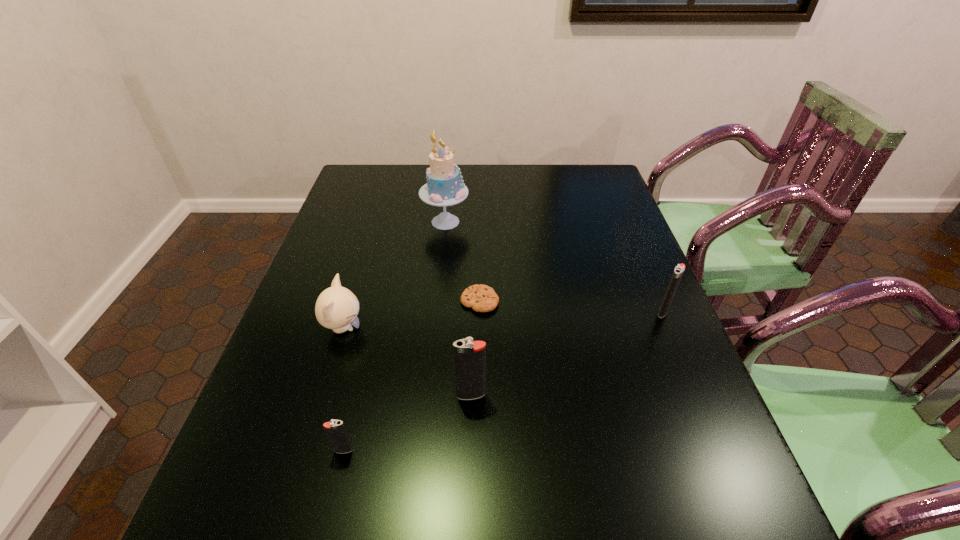
The width and height of the screenshot is (960, 540). In order to click on vacant region that satisfies the following two spatial constraints: 1. on the face of the fourth tallest object; 2. on the back side of the fifth farthest object in this screenshot , I will do `click(323, 395)`.

Where is `free spot that satisfies the following two spatial constraints: 1. with a ladder on the side of the rightmost object; 2. on the right side of the farthest object`? This screenshot has height=540, width=960. free spot that satisfies the following two spatial constraints: 1. with a ladder on the side of the rightmost object; 2. on the right side of the farthest object is located at coordinates (437, 312).

I want to click on vacant space that satisfies the following two spatial constraints: 1. on the face of the leftmost igniter; 2. on the right side of the kitten, so click(x=305, y=450).

Find the location of a particular element. The height and width of the screenshot is (540, 960). blank area in the image that satisfies the following two spatial constraints: 1. with a ladder on the side of the farthest object; 2. on the right side of the second igniter from right to left is located at coordinates (428, 395).

Where is `free space that satisfies the following two spatial constraints: 1. on the back side of the shortest object; 2. with a ladder on the side of the tallest object`? The width and height of the screenshot is (960, 540). free space that satisfies the following two spatial constraints: 1. on the back side of the shortest object; 2. with a ladder on the side of the tallest object is located at coordinates (480, 222).

What are the coordinates of `free location that satisfies the following two spatial constraints: 1. with a ladder on the side of the second igniter from right to left; 2. on the left side of the cake` in the screenshot? It's located at (428, 395).